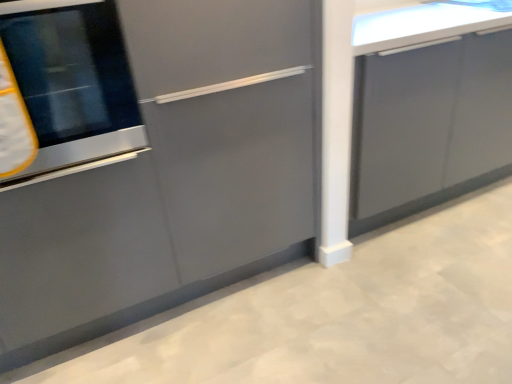
Question: From the image's perspective, is matte gray cabinet at left, acting as the 2th cabinetry starting from the right, on glossy gray cabinet at right, placed as the 1th cabinetry when sorted from right to left?

Choices:
 (A) yes
 (B) no

Answer: (B)

Question: Is matte gray cabinet at left, which is the first cabinetry in left-to-right order, further to camera compared to glossy gray cabinet at right, placed as the 1th cabinetry when sorted from right to left?

Choices:
 (A) yes
 (B) no

Answer: (B)

Question: Is matte gray cabinet at left, which is the first cabinetry in left-to-right order, far away from glossy gray cabinet at right, positioned as the second cabinetry in left-to-right order?

Choices:
 (A) no
 (B) yes

Answer: (A)

Question: From a real-world perspective, is matte gray cabinet at left, acting as the 2th cabinetry starting from the right, over glossy gray cabinet at right, positioned as the second cabinetry in left-to-right order?

Choices:
 (A) no
 (B) yes

Answer: (B)

Question: Can you confirm if matte gray cabinet at left, which is the first cabinetry in left-to-right order, is positioned to the right of glossy gray cabinet at right, positioned as the second cabinetry in left-to-right order?

Choices:
 (A) yes
 (B) no

Answer: (B)

Question: Is matte gray cabinet at left, which is the first cabinetry in left-to-right order, not inside glossy gray cabinet at right, placed as the 1th cabinetry when sorted from right to left?

Choices:
 (A) no
 (B) yes

Answer: (B)

Question: Is glossy gray cabinet at right, positioned as the second cabinetry in left-to-right order, surrounding stainless steel oven at left?

Choices:
 (A) no
 (B) yes

Answer: (A)

Question: From a real-world perspective, is glossy gray cabinet at right, placed as the 1th cabinetry when sorted from right to left, under stainless steel oven at left?

Choices:
 (A) yes
 (B) no

Answer: (A)

Question: Does glossy gray cabinet at right, positioned as the second cabinetry in left-to-right order, appear on the right side of stainless steel oven at left?

Choices:
 (A) no
 (B) yes

Answer: (B)

Question: From a real-world perspective, is glossy gray cabinet at right, placed as the 1th cabinetry when sorted from right to left, on stainless steel oven at left?

Choices:
 (A) yes
 (B) no

Answer: (B)

Question: Is glossy gray cabinet at right, positioned as the second cabinetry in left-to-right order, outside of stainless steel oven at left?

Choices:
 (A) no
 (B) yes

Answer: (B)

Question: Can you confirm if glossy gray cabinet at right, positioned as the second cabinetry in left-to-right order, is smaller than stainless steel oven at left?

Choices:
 (A) yes
 (B) no

Answer: (B)

Question: From the image's perspective, would you say matte gray cabinet at left, which is the first cabinetry in left-to-right order, is shown under stainless steel oven at left?

Choices:
 (A) no
 (B) yes

Answer: (B)